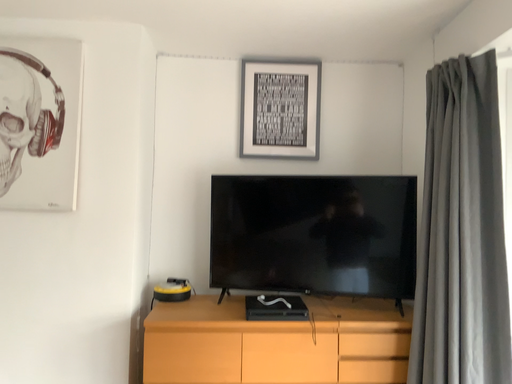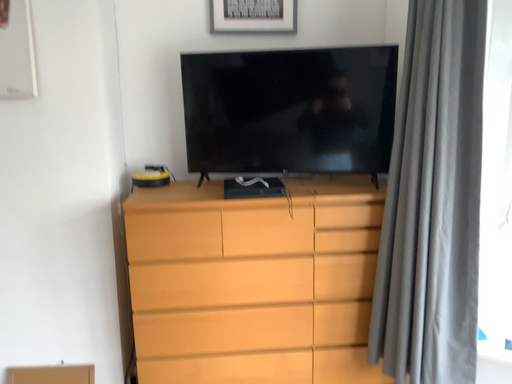
Question: How did the camera likely rotate when shooting the video?

Choices:
 (A) rotated upward
 (B) rotated downward

Answer: (B)